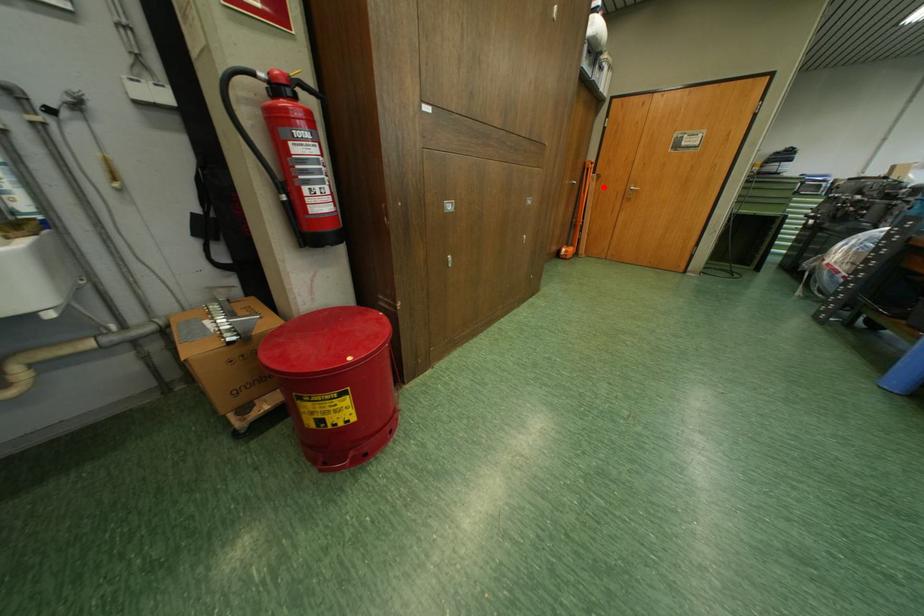
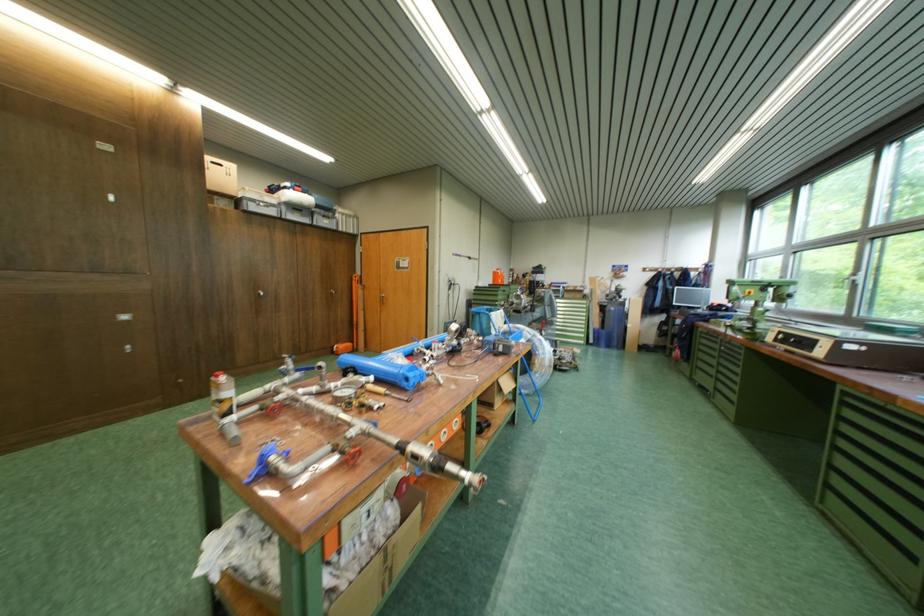
The point at the highlighted location is marked in the first image. Where is the corresponding point in the second image?

(371, 294)